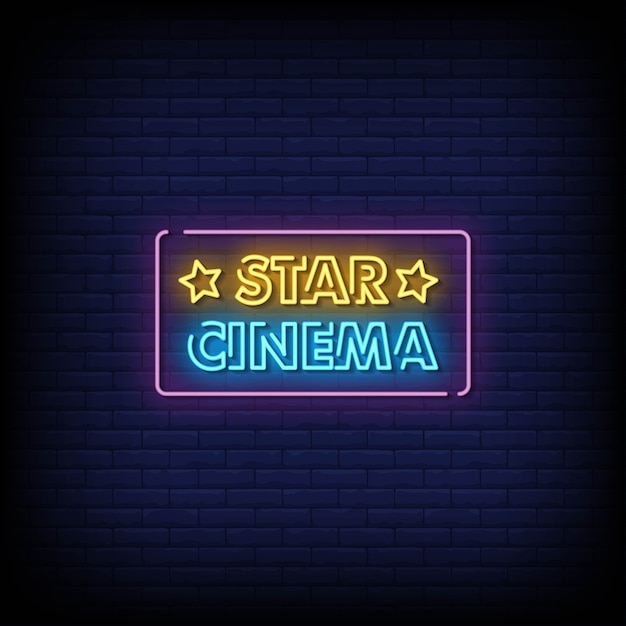
The height and width of the screenshot is (626, 626). What are the coordinates of `pink neon border` in the screenshot? It's located at coord(372,390).